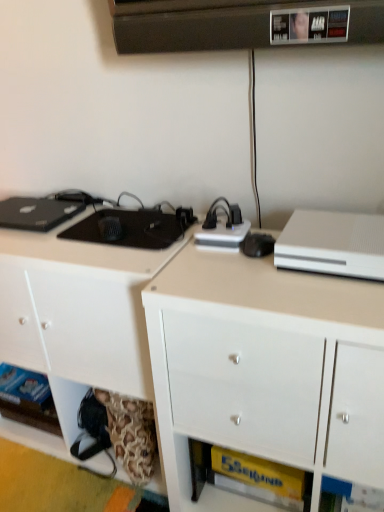
This screenshot has width=384, height=512. What do you see at coordinates (266, 366) in the screenshot?
I see `white glossy cabinet at center, placed as the second cabinetry when sorted from left to right` at bounding box center [266, 366].

The width and height of the screenshot is (384, 512). In order to click on white glossy cabinet at center, marked as the first cabinetry in a right-to-left arrangement in this screenshot , I will do `click(266, 366)`.

Is white matte desktop computer at upper right closer to the viewer compared to white matte cabinet at lower left, the 2th cabinetry positioned from the right?

Yes, the depth of white matte desktop computer at upper right is less than that of white matte cabinet at lower left, the 2th cabinetry positioned from the right.

Is white matte desktop computer at upper right touching white matte cabinet at lower left, which ranks as the first cabinetry in left-to-right order?

No, white matte desktop computer at upper right is not making contact with white matte cabinet at lower left, which ranks as the first cabinetry in left-to-right order.

Could you tell me if white matte desktop computer at upper right is facing white matte cabinet at lower left, the 2th cabinetry positioned from the right?

No, white matte desktop computer at upper right is not facing towards white matte cabinet at lower left, the 2th cabinetry positioned from the right.

Looking at their sizes, would you say white matte desktop computer at upper right is wider or thinner than white matte cabinet at lower left, which ranks as the first cabinetry in left-to-right order?

In the image, white matte desktop computer at upper right appears to be more narrow than white matte cabinet at lower left, which ranks as the first cabinetry in left-to-right order.

Which is more to the left, white glossy cabinet at center, marked as the first cabinetry in a right-to-left arrangement, or white matte desktop computer at upper right?

white glossy cabinet at center, marked as the first cabinetry in a right-to-left arrangement, is more to the left.

Considering the sizes of objects white glossy cabinet at center, marked as the first cabinetry in a right-to-left arrangement, and white matte desktop computer at upper right in the image provided, who is smaller, white glossy cabinet at center, marked as the first cabinetry in a right-to-left arrangement, or white matte desktop computer at upper right?

white matte desktop computer at upper right.

Is white glossy cabinet at center, marked as the first cabinetry in a right-to-left arrangement, looking in the opposite direction of white matte desktop computer at upper right?

That's not correct — white glossy cabinet at center, marked as the first cabinetry in a right-to-left arrangement, is not looking away from white matte desktop computer at upper right.

Can you see white glossy cabinet at center, placed as the second cabinetry when sorted from left to right, touching white matte desktop computer at upper right?

white glossy cabinet at center, placed as the second cabinetry when sorted from left to right, and white matte desktop computer at upper right are not in contact.

Would you say white matte cabinet at lower left, which ranks as the first cabinetry in left-to-right order, contains white matte desktop computer at upper right?

No, white matte desktop computer at upper right is located outside of white matte cabinet at lower left, which ranks as the first cabinetry in left-to-right order.

From a real-world perspective, does white matte cabinet at lower left, which ranks as the first cabinetry in left-to-right order, sit lower than white matte desktop computer at upper right?

Yes.

Which cabinetry is the 2nd one when counting from the left side of the white matte desktop computer at upper right? Please provide its 2D coordinates.

[(77, 314)]

Is white glossy cabinet at center, placed as the second cabinetry when sorted from left to right, taller or shorter than white matte cabinet at lower left, the 2th cabinetry positioned from the right?

Clearly, white glossy cabinet at center, placed as the second cabinetry when sorted from left to right, is taller compared to white matte cabinet at lower left, the 2th cabinetry positioned from the right.

Is white glossy cabinet at center, marked as the first cabinetry in a right-to-left arrangement, with white matte cabinet at lower left, the 2th cabinetry positioned from the right?

No, white glossy cabinet at center, marked as the first cabinetry in a right-to-left arrangement, is not with white matte cabinet at lower left, the 2th cabinetry positioned from the right.

Can you confirm if white glossy cabinet at center, placed as the second cabinetry when sorted from left to right, is positioned to the left of white matte cabinet at lower left, the 2th cabinetry positioned from the right?

No.

Looking at the image, does white glossy cabinet at center, placed as the second cabinetry when sorted from left to right, seem bigger or smaller compared to white matte cabinet at lower left, the 2th cabinetry positioned from the right?

Considering their sizes, white glossy cabinet at center, placed as the second cabinetry when sorted from left to right, takes up less space than white matte cabinet at lower left, the 2th cabinetry positioned from the right.

Can you tell me how much white matte desktop computer at upper right and white glossy cabinet at center, placed as the second cabinetry when sorted from left to right, differ in facing direction?

white matte desktop computer at upper right and white glossy cabinet at center, placed as the second cabinetry when sorted from left to right, are facing 0.184 degrees away from each other.

Is white matte desktop computer at upper right far away from white glossy cabinet at center, placed as the second cabinetry when sorted from left to right?

white matte desktop computer at upper right is near white glossy cabinet at center, placed as the second cabinetry when sorted from left to right, not far away.

Between white matte desktop computer at upper right and white glossy cabinet at center, marked as the first cabinetry in a right-to-left arrangement, which one appears on the right side from the viewer's perspective?

From the viewer's perspective, white matte desktop computer at upper right appears more on the right side.

Between white matte cabinet at lower left, the 2th cabinetry positioned from the right, and white glossy cabinet at center, placed as the second cabinetry when sorted from left to right, which one has larger size?

white matte cabinet at lower left, the 2th cabinetry positioned from the right, is bigger.

Considering the relative positions of white matte cabinet at lower left, the 2th cabinetry positioned from the right, and white glossy cabinet at center, placed as the second cabinetry when sorted from left to right, in the image provided, is white matte cabinet at lower left, the 2th cabinetry positioned from the right, behind white glossy cabinet at center, placed as the second cabinetry when sorted from left to right,?

Yes, it is behind white glossy cabinet at center, placed as the second cabinetry when sorted from left to right.

Who is shorter, white matte cabinet at lower left, the 2th cabinetry positioned from the right, or white glossy cabinet at center, marked as the first cabinetry in a right-to-left arrangement?

white matte cabinet at lower left, the 2th cabinetry positioned from the right.

Considering the positions of objects white matte cabinet at lower left, which ranks as the first cabinetry in left-to-right order, and white glossy cabinet at center, placed as the second cabinetry when sorted from left to right, in the image provided, who is more to the left, white matte cabinet at lower left, which ranks as the first cabinetry in left-to-right order, or white glossy cabinet at center, placed as the second cabinetry when sorted from left to right,?

white matte cabinet at lower left, which ranks as the first cabinetry in left-to-right order.

Locate an element on the screen. This screenshot has width=384, height=512. the 1st cabinetry positioned below the white matte desktop computer at upper right (from the image's perspective) is located at coordinates (77, 314).

At what (x,y) coordinates should I click in order to perform the action: click on desktop computer that appears above the white glossy cabinet at center, marked as the first cabinetry in a right-to-left arrangement (from the image's perspective). Please return your answer as a coordinate pair (x, y). This screenshot has width=384, height=512. Looking at the image, I should click on (333, 244).

Which object lies nearer to the anchor point white matte cabinet at lower left, the 2th cabinetry positioned from the right, white glossy cabinet at center, marked as the first cabinetry in a right-to-left arrangement, or white matte desktop computer at upper right?

Based on the image, white glossy cabinet at center, marked as the first cabinetry in a right-to-left arrangement, appears to be nearer to white matte cabinet at lower left, the 2th cabinetry positioned from the right.

When comparing their distances from white matte desktop computer at upper right, does white glossy cabinet at center, placed as the second cabinetry when sorted from left to right, or white matte cabinet at lower left, the 2th cabinetry positioned from the right, seem closer?

The object closer to white matte desktop computer at upper right is white glossy cabinet at center, placed as the second cabinetry when sorted from left to right.

Based on the photo, looking at the image, which one is located further to white glossy cabinet at center, placed as the second cabinetry when sorted from left to right, white matte desktop computer at upper right or white matte cabinet at lower left, the 2th cabinetry positioned from the right?

white matte cabinet at lower left, the 2th cabinetry positioned from the right.

Which object lies further to the anchor point white matte cabinet at lower left, the 2th cabinetry positioned from the right, white matte desktop computer at upper right or white glossy cabinet at center, marked as the first cabinetry in a right-to-left arrangement?

white matte desktop computer at upper right is further to white matte cabinet at lower left, the 2th cabinetry positioned from the right.

From the image, which object appears to be nearer to white matte desktop computer at upper right, white matte cabinet at lower left, the 2th cabinetry positioned from the right, or white glossy cabinet at center, placed as the second cabinetry when sorted from left to right?

white glossy cabinet at center, placed as the second cabinetry when sorted from left to right, is positioned closer to the anchor white matte desktop computer at upper right.

Based on the photo, considering their positions, is white matte cabinet at lower left, which ranks as the first cabinetry in left-to-right order, positioned closer to white glossy cabinet at center, placed as the second cabinetry when sorted from left to right, than white matte desktop computer at upper right?

white matte desktop computer at upper right is closer to white glossy cabinet at center, placed as the second cabinetry when sorted from left to right.

Where is `cabinetry between white matte cabinet at lower left, which ranks as the first cabinetry in left-to-right order, and white matte desktop computer at upper right`? The height and width of the screenshot is (512, 384). cabinetry between white matte cabinet at lower left, which ranks as the first cabinetry in left-to-right order, and white matte desktop computer at upper right is located at coordinates (266, 366).